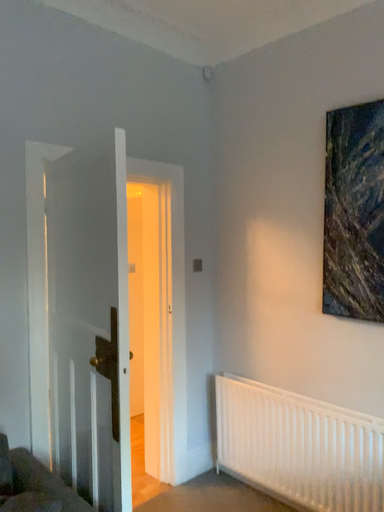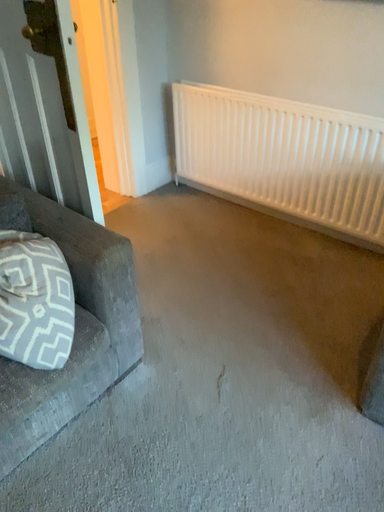
Question: How did the camera likely rotate when shooting the video?

Choices:
 (A) rotated downward
 (B) rotated upward

Answer: (A)